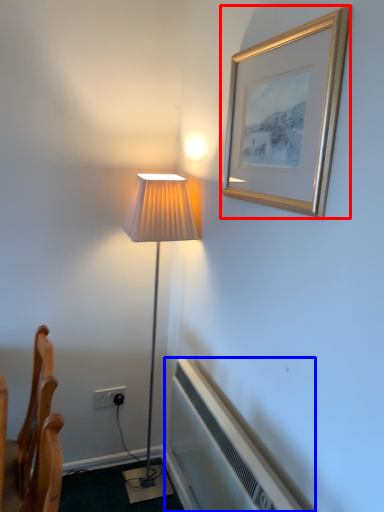
Question: Which of the following is the closest to the observer, picture frame (highlighted by a red box) or air conditioner (highlighted by a blue box)?

Choices:
 (A) picture frame
 (B) air conditioner

Answer: (A)